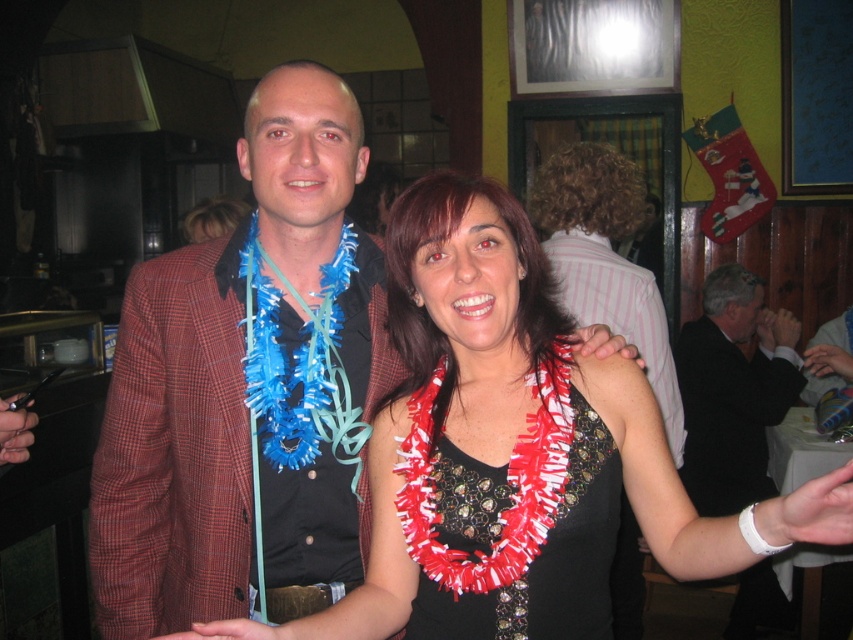
Is plaid fabric jacket at center further to the viewer compared to black sequined dress at center?

Yes, it is.

Can you confirm if plaid fabric jacket at center is positioned above black sequined dress at center?

Yes.

The width and height of the screenshot is (853, 640). In order to click on plaid fabric jacket at center in this screenshot , I will do `click(241, 384)`.

Can you confirm if black sequined dress at center is shorter than black leather jacket at upper right?

Indeed, black sequined dress at center has a lesser height compared to black leather jacket at upper right.

The height and width of the screenshot is (640, 853). What do you see at coordinates (512, 518) in the screenshot?
I see `black sequined dress at center` at bounding box center [512, 518].

Where is `black sequined dress at center`? black sequined dress at center is located at coordinates (512, 518).

Who is shorter, plaid fabric jacket at center or red fringed lei at center?

Standing shorter between the two is red fringed lei at center.

Can you confirm if plaid fabric jacket at center is shorter than red fringed lei at center?

No.

Identify the location of plaid fabric jacket at center. The image size is (853, 640). (241, 384).